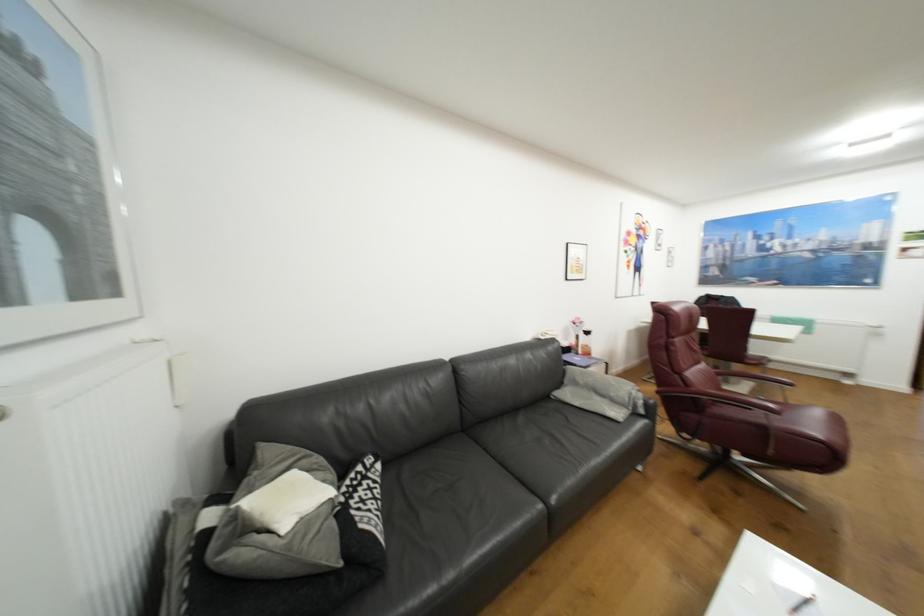
Find the location of a particular element. orange bottle is located at coordinates (584, 342).